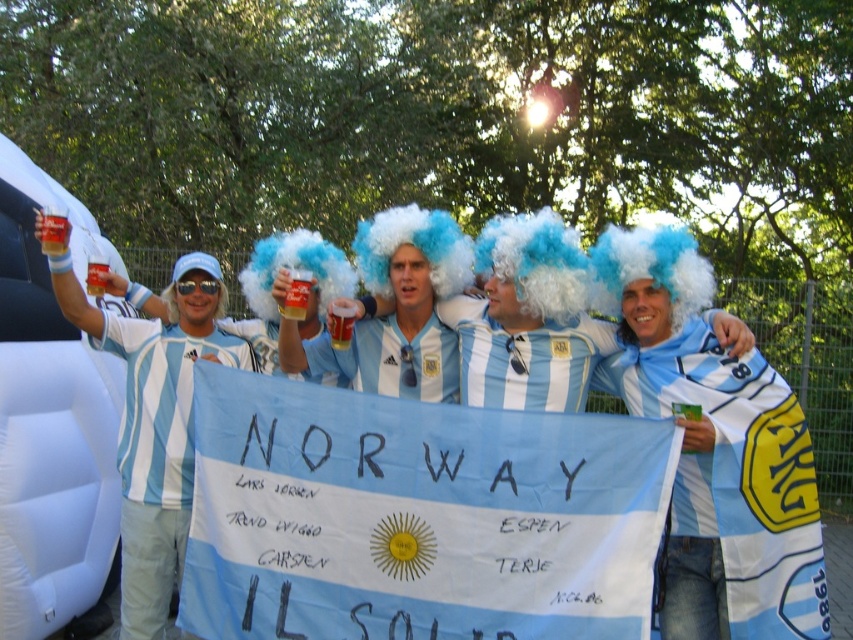
You are a photographer at the event and want to capture a closeup of the translucent plastic cup at upper left and the white fluffy wig at upper left in the same frame. The camera you are using has a maximum focus range of 90 centimeters. Can you take the photo without moving either object?

The translucent plastic cup at upper left is 91.56 centimeters away from the white fluffy wig at upper left. Since the distance between them exceeds the camera maximum focus range of 90 centimeters, you cannot take the photo without moving either object.

You are a photographer at the event and want to capture a clear photo of the white fluffy wig at upper left without the translucent plastic cup at upper left blocking it. What should you do?

Move the translucent plastic cup at upper left so that it is no longer covering the white fluffy wig at upper left, as the cup is currently positioned over the wig and obstructing the view.